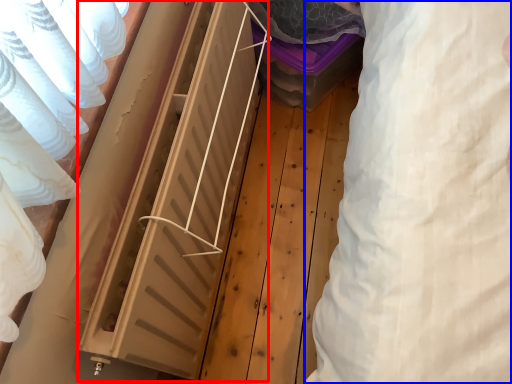
Question: Among these objects, which one is farthest to the camera, radiator (highlighted by a red box) or clothing (highlighted by a blue box)?

Choices:
 (A) radiator
 (B) clothing

Answer: (A)